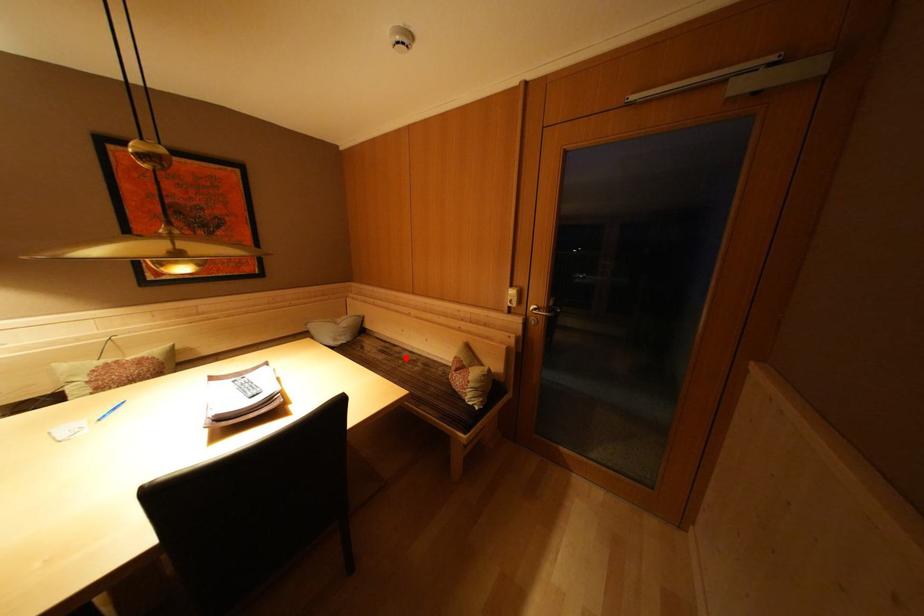
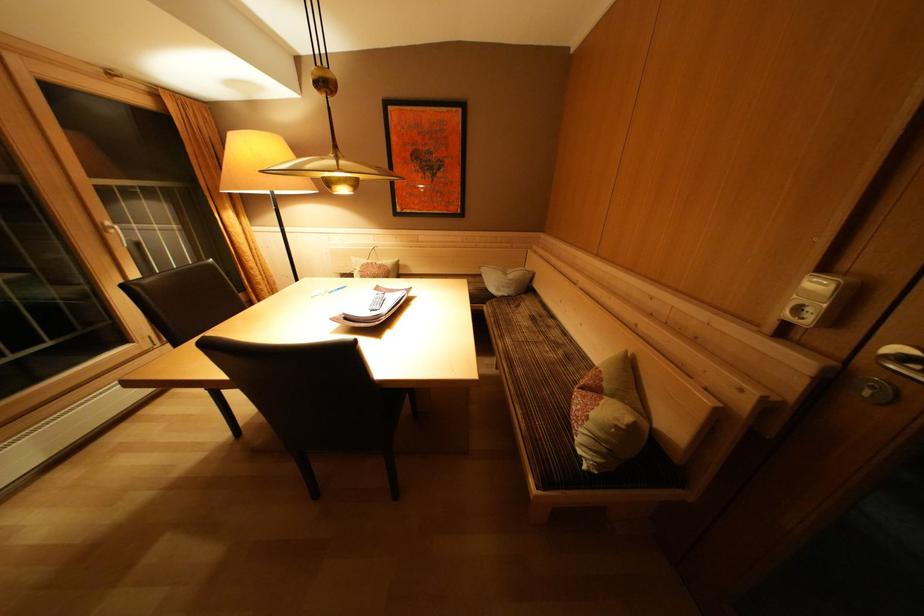
The point at the highlighted location is marked in the first image. Where is the corresponding point in the second image?

(555, 331)